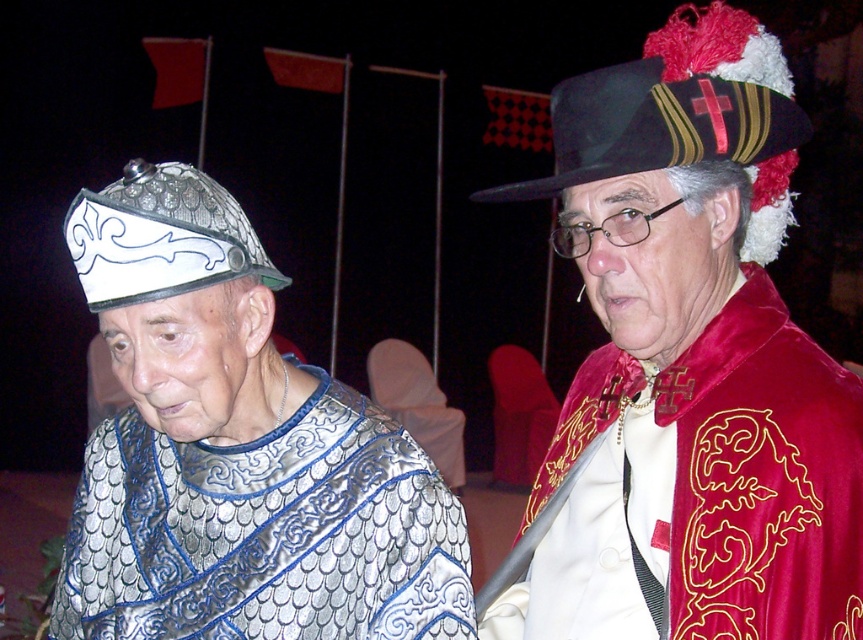
Who is taller, velvet red cape at upper right or white metallic helmet at left?

velvet red cape at upper right is taller.

Which is more to the left, velvet red cape at upper right or white metallic helmet at left?

From the viewer's perspective, white metallic helmet at left appears more on the left side.

What do you see at coordinates (685, 365) in the screenshot? I see `velvet red cape at upper right` at bounding box center [685, 365].

I want to click on velvet red cape at upper right, so click(x=685, y=365).

Is point (772, 298) in front of point (725, 136)?

No, it is behind (725, 136).

Is velvet red cape at upper right below black felt hat at upper right?

Yes.

Which is in front, point (620, 595) or point (697, 104)?

Point (697, 104) is more forward.

The width and height of the screenshot is (863, 640). What are the coordinates of `velvet red cape at upper right` in the screenshot? It's located at (685, 365).

Is metallic chainmail at left smaller than black felt hat at upper right?

Yes.

Based on the photo, is metallic chainmail at left closer to camera compared to black felt hat at upper right?

That is True.

Between point (312, 609) and point (792, 115), which one is positioned behind?

Positioned behind is point (312, 609).

Locate an element on the screen. The width and height of the screenshot is (863, 640). metallic chainmail at left is located at coordinates (236, 451).